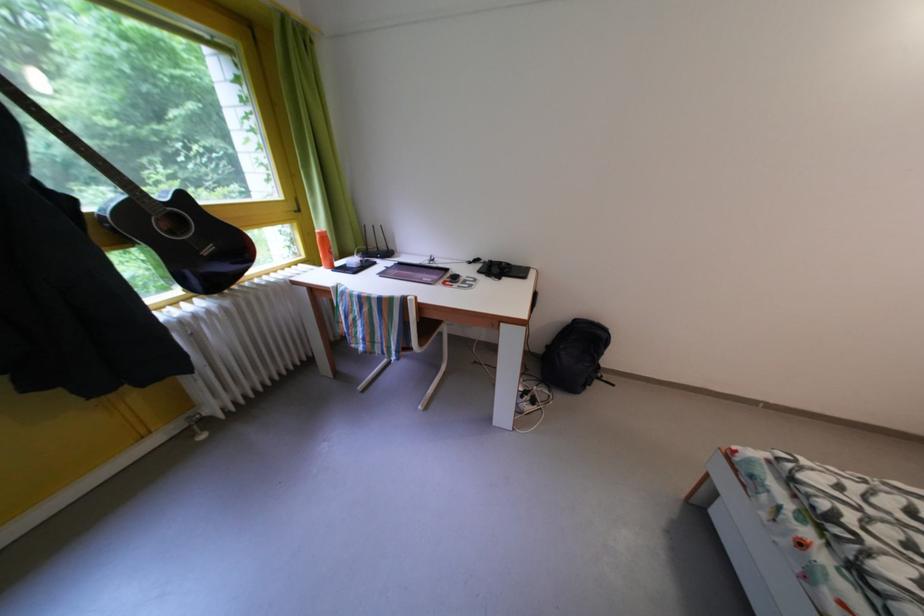
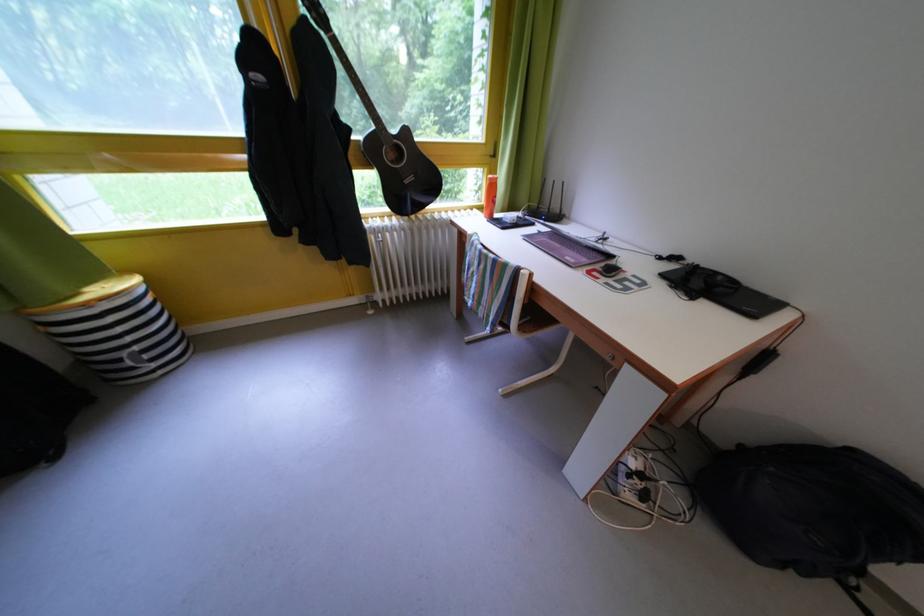
Question: The camera is either moving clockwise (left) or counter-clockwise (right) around the object. The first image is from the beginning of the video and the second image is from the end. Is the camera moving left or right when shooting the video?

Choices:
 (A) Left
 (B) Right

Answer: (B)